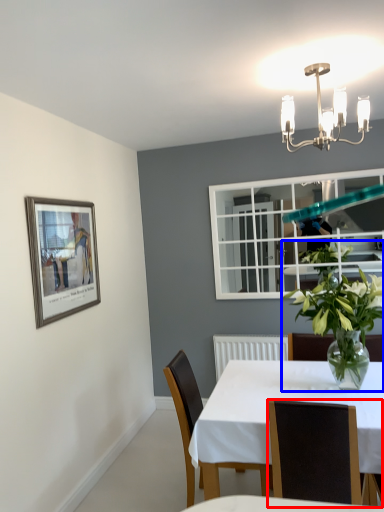
Question: Among these objects, which one is farthest to the camera, chair (highlighted by a red box) or houseplant (highlighted by a blue box)?

Choices:
 (A) chair
 (B) houseplant

Answer: (B)